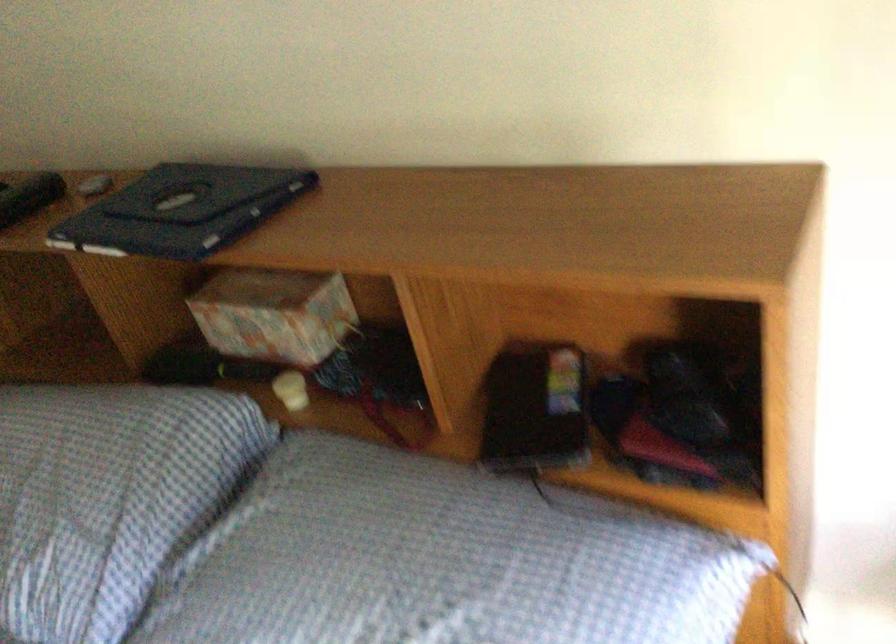
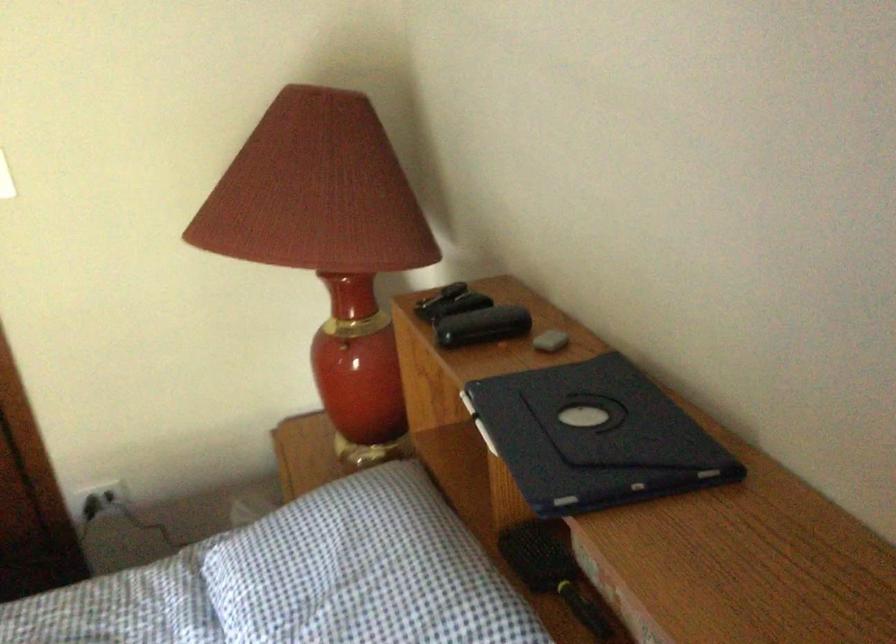
Where in the second image is the point corresponding to point (202, 368) from the first image?

(552, 571)